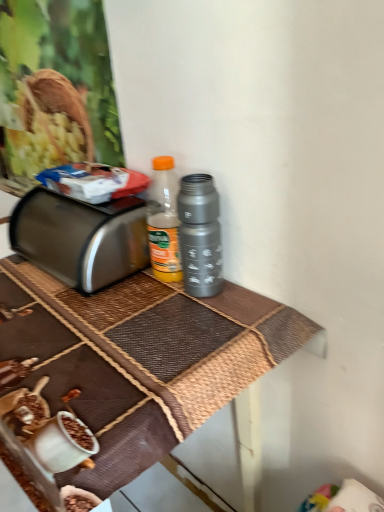
Locate an element on the screen. Image resolution: width=384 pixels, height=512 pixels. vacant space situated on the left part of metallic gray thermos at center is located at coordinates (117, 304).